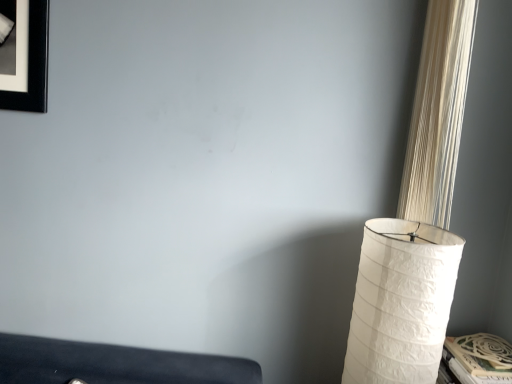
The image size is (512, 384). What do you see at coordinates (401, 302) in the screenshot?
I see `white textured lampshade at right` at bounding box center [401, 302].

Image resolution: width=512 pixels, height=384 pixels. I want to click on white textured lampshade at right, so click(401, 302).

Describe the element at coordinates (438, 113) in the screenshot. I see `white textured curtain at right` at that location.

What are the coordinates of `white textured curtain at right` in the screenshot? It's located at (438, 113).

The width and height of the screenshot is (512, 384). In order to click on white textured lampshade at right in this screenshot , I will do `click(401, 302)`.

Which object is positioned more to the left, white textured curtain at right or white textured lampshade at right?

white textured lampshade at right.

Is the position of white textured curtain at right less distant than that of white textured lampshade at right?

No, it is behind white textured lampshade at right.

Considering the positions of points (435, 148) and (369, 243), is point (435, 148) closer to camera compared to point (369, 243)?

No.

From the image's perspective, is white textured curtain at right below white textured lampshade at right?

Actually, white textured curtain at right appears above white textured lampshade at right in the image.

From a real-world perspective, who is located higher, white textured curtain at right or white textured lampshade at right?

white textured curtain at right, from a real-world perspective.

Considering the sizes of white textured curtain at right and white textured lampshade at right in the image, is white textured curtain at right wider or thinner than white textured lampshade at right?

In the image, white textured curtain at right appears to be more narrow than white textured lampshade at right.

Can you confirm if white textured curtain at right is shorter than white textured lampshade at right?

In fact, white textured curtain at right may be taller than white textured lampshade at right.

Looking at the image, does white textured curtain at right seem bigger or smaller compared to white textured lampshade at right?

white textured curtain at right is smaller than white textured lampshade at right.

Is white textured curtain at right inside the boundaries of white textured lampshade at right, or outside?

white textured curtain at right cannot be found inside white textured lampshade at right.

Does white textured curtain at right touch white textured lampshade at right?

white textured curtain at right and white textured lampshade at right are clearly separated.

Is white textured curtain at right aimed at white textured lampshade at right?

No, white textured curtain at right is not facing towards white textured lampshade at right.

What's the angular difference between white textured curtain at right and white textured lampshade at right's facing directions?

1.95 degrees.

How distant is white textured curtain at right from white textured lampshade at right?

white textured curtain at right is 10.21 inches from white textured lampshade at right.

In the image, there is a white textured curtain at right. Identify the location of lamp below it (from the image's perspective). (401, 302).

Can you confirm if white textured lampshade at right is positioned to the right of white textured curtain at right?

Incorrect, white textured lampshade at right is not on the right side of white textured curtain at right.

From the picture: Which object is more forward, white textured lampshade at right or white textured curtain at right?

Positioned in front is white textured lampshade at right.

Between point (413, 291) and point (426, 31), which one is positioned behind?

Point (426, 31)

From the image's perspective, would you say white textured lampshade at right is positioned over white textured curtain at right?

No.

From a real-world perspective, is white textured lampshade at right beneath white textured curtain at right?

Yes.

Does white textured lampshade at right have a lesser width compared to white textured curtain at right?

In fact, white textured lampshade at right might be wider than white textured curtain at right.

Considering the relative sizes of white textured lampshade at right and white textured curtain at right in the image provided, is white textured lampshade at right taller than white textured curtain at right?

No, white textured lampshade at right is not taller than white textured curtain at right.

Considering the relative sizes of white textured lampshade at right and white textured curtain at right in the image provided, is white textured lampshade at right smaller than white textured curtain at right?

No.

Would you say white textured lampshade at right is outside white textured curtain at right?

Yes, white textured lampshade at right is outside of white textured curtain at right.

Is white textured lampshade at right positioned far away from white textured curtain at right?

No, white textured lampshade at right is not far away from white textured curtain at right.

In the scene shown: Could you tell me if white textured lampshade at right is turned towards white textured curtain at right?

No, white textured lampshade at right does not turn towards white textured curtain at right.

How many degrees apart are the facing directions of white textured lampshade at right and white textured curtain at right?

The facing directions of white textured lampshade at right and white textured curtain at right are 1.95 degrees apart.

Measure the distance from white textured lampshade at right to white textured curtain at right.

white textured lampshade at right and white textured curtain at right are 25.94 centimeters apart.

This screenshot has height=384, width=512. What are the coordinates of `lamp in front of the white textured curtain at right` in the screenshot? It's located at (401, 302).

This screenshot has width=512, height=384. Identify the location of curtain located above the white textured lampshade at right (from the image's perspective). (438, 113).

In the image, there is a white textured curtain at right. Where is `lamp below it (from the image's perspective)`? lamp below it (from the image's perspective) is located at coordinates (401, 302).